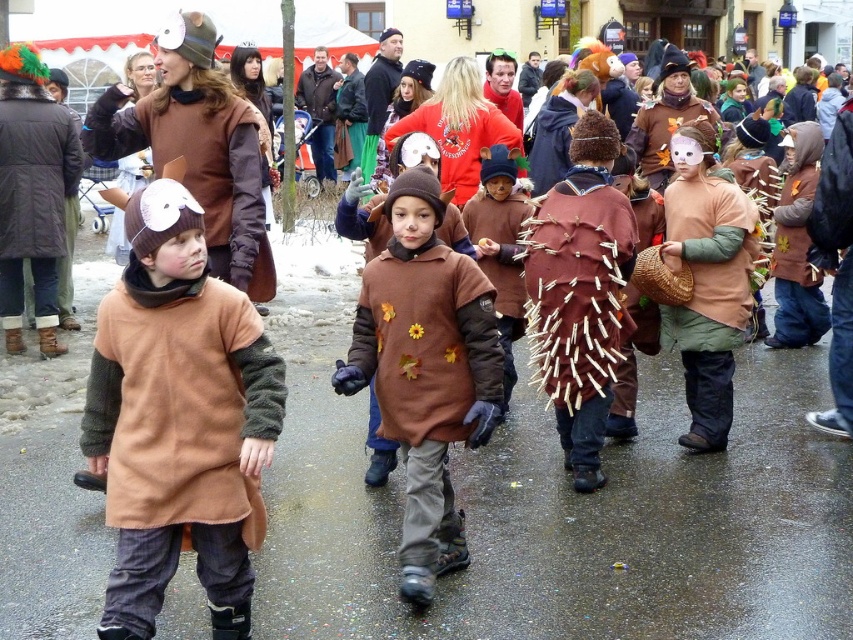
Question: Which of the following is the closest to the observer?

Choices:
 (A) (672, 344)
 (B) (102, 432)

Answer: (B)

Question: Which of the following is the farthest from the observer?

Choices:
 (A) matte brown costume at center
 (B) brown felt dress at center
 (C) brown felt costume at center
 (D) matte brown dress at center

Answer: (C)

Question: Can you confirm if matte brown dress at center is positioned to the right of brown felt dress at center?

Choices:
 (A) yes
 (B) no

Answer: (B)

Question: Is matte brown dress at center to the right of brown felt dress at center from the viewer's perspective?

Choices:
 (A) yes
 (B) no

Answer: (B)

Question: Can you confirm if matte brown dress at center is positioned to the left of matte brown costume at center?

Choices:
 (A) yes
 (B) no

Answer: (A)

Question: Among these points, which one is nearest to the camera?

Choices:
 (A) (729, 387)
 (B) (129, 400)

Answer: (B)